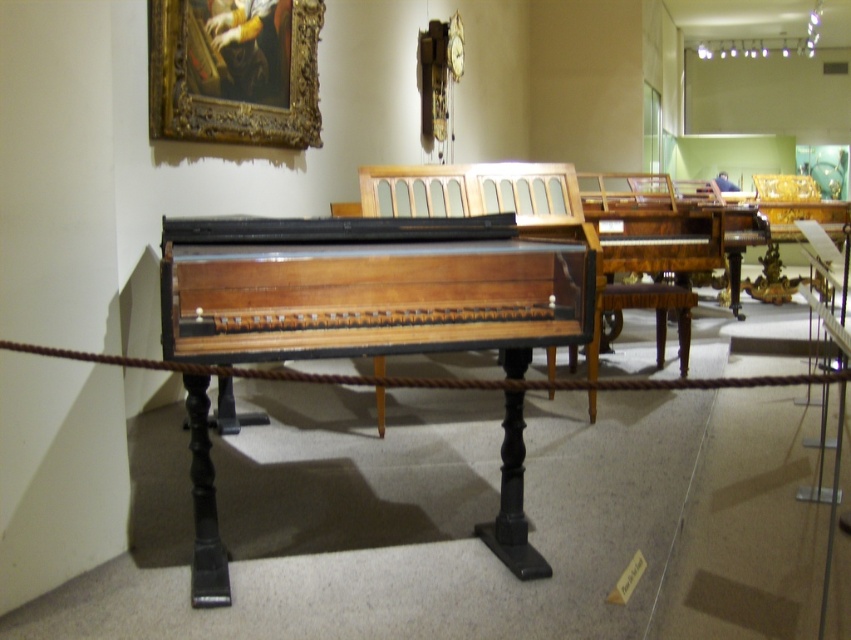
Question: Does wooden polished piano at center have a smaller size compared to gold ornate frame at upper left?

Choices:
 (A) yes
 (B) no

Answer: (B)

Question: Can you confirm if wooden polished piano at center is positioned to the left of gold ornate frame at upper left?

Choices:
 (A) yes
 (B) no

Answer: (B)

Question: Does wooden polished piano at center have a larger size compared to gold ornate frame at upper left?

Choices:
 (A) no
 (B) yes

Answer: (B)

Question: Among these points, which one is farthest from the camera?

Choices:
 (A) (460, 227)
 (B) (317, 84)

Answer: (B)